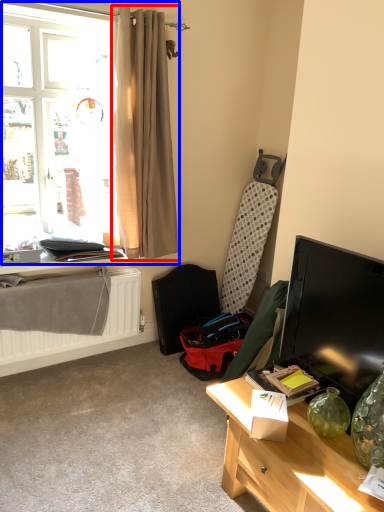
Question: Which object is further to the camera taking this photo, curtain (highlighted by a red box) or window (highlighted by a blue box)?

Choices:
 (A) curtain
 (B) window

Answer: (A)